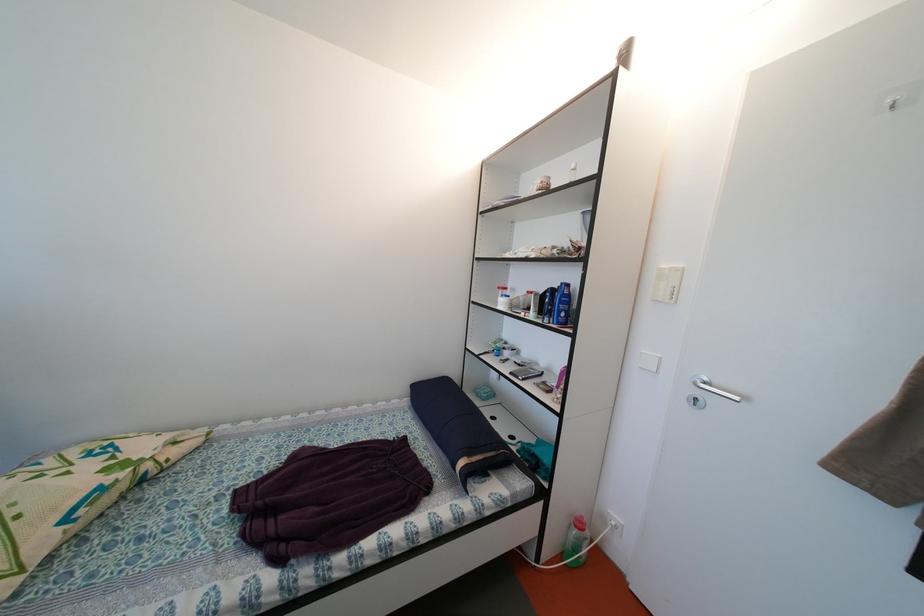
Where would you turn the metal door handle? Please return your answer as a coordinate pair (x, y).

(714, 390)